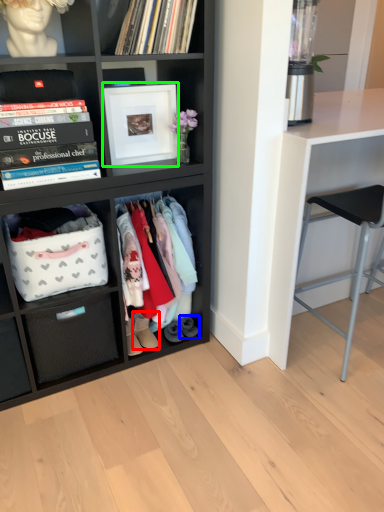
Question: Based on their relative distances, which object is farther from footwear (highlighted by a red box)? Choose from footwear (highlighted by a blue box) and picture frame (highlighted by a green box).

Choices:
 (A) footwear
 (B) picture frame

Answer: (B)